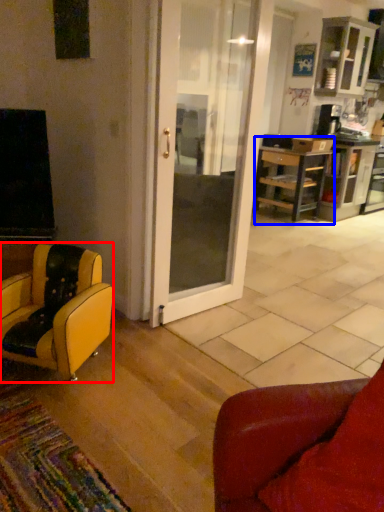
Question: Which of the following is the farthest to the observer, chair (highlighted by a red box) or desk (highlighted by a blue box)?

Choices:
 (A) chair
 (B) desk

Answer: (B)